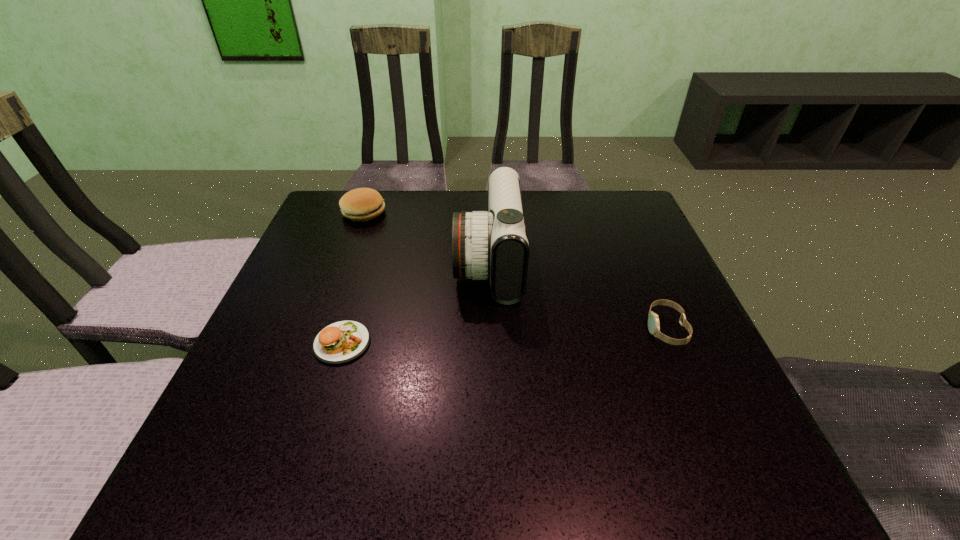
You are a GUI agent. You are given a task and a screenshot of the screen. Output one action in this format:
    pyautogui.click(x=<x>, y=<y>)
    Task: Click on the free point at the left edge
    This screenshot has width=960, height=540.
    Given the screenshot: What is the action you would take?
    pyautogui.click(x=297, y=314)

At what (x,y) coordinates should I click in order to perform the action: click on vacant space at the right edge of the desktop. Please return your answer as a coordinate pair (x, y). This screenshot has width=960, height=540. Looking at the image, I should click on coord(628,339).

Locate an element on the screen. Image resolution: width=960 pixels, height=540 pixels. free space at the far left corner of the desktop is located at coordinates (327, 207).

Where is `vacant area at the near left corner of the desktop`? Image resolution: width=960 pixels, height=540 pixels. vacant area at the near left corner of the desktop is located at coordinates (222, 461).

This screenshot has width=960, height=540. Find the location of `vacant space at the far right corner of the desktop`. vacant space at the far right corner of the desktop is located at coordinates (625, 205).

Locate an element on the screen. vacant space at the near right corner of the desktop is located at coordinates (769, 462).

Locate an element on the screen. This screenshot has height=540, width=960. free space between the watch and the tallest object is located at coordinates (577, 295).

Where is `free space between the camcorder and the rightmost object`? This screenshot has height=540, width=960. free space between the camcorder and the rightmost object is located at coordinates point(577,295).

Identify the location of free area in between the camcorder and the third shortest object. The height and width of the screenshot is (540, 960). (426, 238).

I want to click on vacant space that is in between the shorter patty and the rightmost object, so click(x=504, y=336).